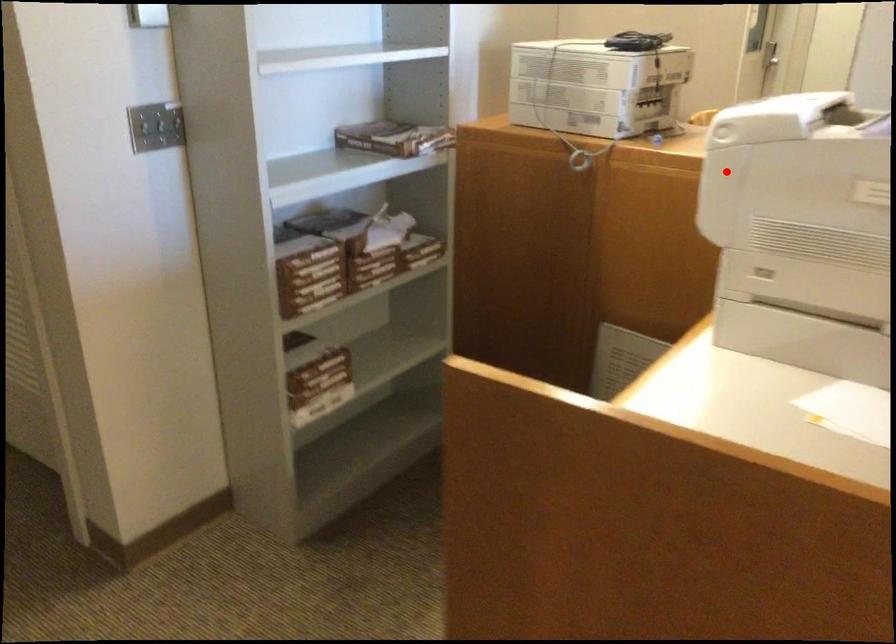
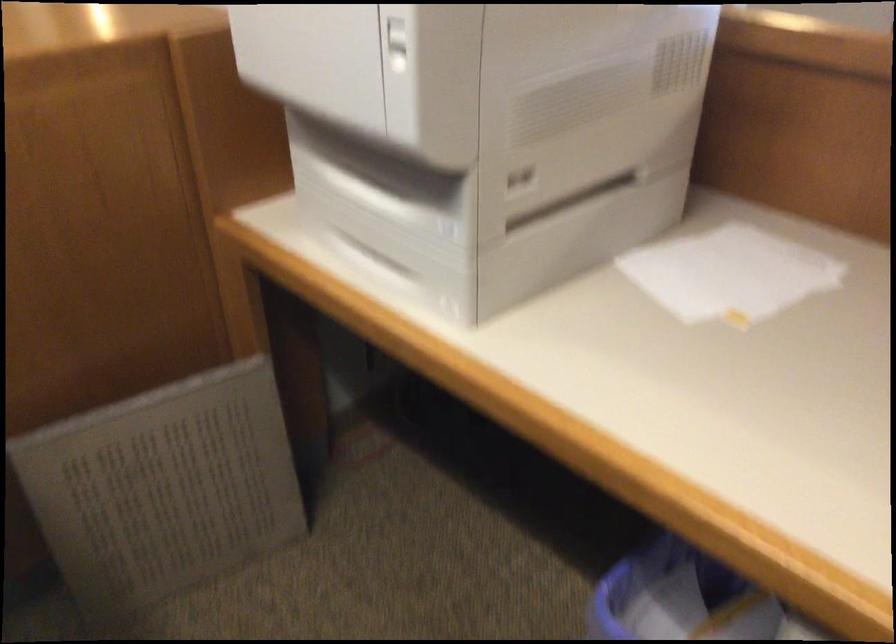
Question: I am providing you with two images of the same scene from different viewpoints. In image1, a red point is highlighted. Considering the same 3D point in image2, which of the following is correct?

Choices:
 (A) It is closer
 (B) It is farther

Answer: (A)